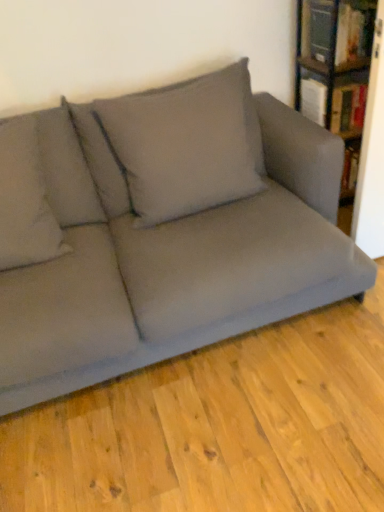
Measure the distance between wooden bookshelf at upper right and camera.

The distance of wooden bookshelf at upper right from camera is 6.03 feet.

Describe the element at coordinates (354, 31) in the screenshot. I see `hardcover book at upper right, which is the 2th book in bottom-to-top order` at that location.

Locate an element on the screen. The image size is (384, 512). gray fabric pillow at upper left, the 1th pillow positioned from the left is located at coordinates (66, 170).

This screenshot has height=512, width=384. Describe the element at coordinates (173, 233) in the screenshot. I see `matte gray couch at center` at that location.

Locate an element on the screen. Image resolution: width=384 pixels, height=512 pixels. hardcover book at upper right, placed as the second book when sorted from top to bottom is located at coordinates (335, 101).

Find the location of a particular element. This screenshot has width=384, height=512. wooden bookshelf at upper right is located at coordinates (336, 47).

Where is `the 2nd book behind the wooden bookshelf at upper right, counting from the anchor's position`? the 2nd book behind the wooden bookshelf at upper right, counting from the anchor's position is located at coordinates coord(335,101).

Could you tell me if wooden bookshelf at upper right is facing hardcover book at upper right, which is the first book from bottom to top?

Yes.

From their relative heights in the image, would you say wooden bookshelf at upper right is taller or shorter than hardcover book at upper right, which is the first book from bottom to top?

In the image, wooden bookshelf at upper right appears to be taller than hardcover book at upper right, which is the first book from bottom to top.

Considering the sizes of objects wooden bookshelf at upper right and hardcover book at upper right, which is the first book from bottom to top, in the image provided, who is smaller, wooden bookshelf at upper right or hardcover book at upper right, which is the first book from bottom to top,?

hardcover book at upper right, which is the first book from bottom to top, is smaller.

Is matte gray couch at center positioned beyond the bounds of hardcover book at upper right, placed as the second book when sorted from top to bottom?

Indeed, matte gray couch at center is completely outside hardcover book at upper right, placed as the second book when sorted from top to bottom.

From a real-world perspective, does matte gray couch at center stand above hardcover book at upper right, placed as the second book when sorted from top to bottom?

No.

From the image's perspective, which is above, matte gray couch at center or hardcover book at upper right, placed as the second book when sorted from top to bottom?

hardcover book at upper right, placed as the second book when sorted from top to bottom, appears higher in the image.

Is there a large distance between wooden bookshelf at upper right and gray fabric pillow at upper center, acting as the 1th pillow starting from the right?

No, wooden bookshelf at upper right is in close proximity to gray fabric pillow at upper center, acting as the 1th pillow starting from the right.

Is wooden bookshelf at upper right to the right of gray fabric pillow at upper center, acting as the 1th pillow starting from the right, from the viewer's perspective?

Correct, you'll find wooden bookshelf at upper right to the right of gray fabric pillow at upper center, acting as the 1th pillow starting from the right.

Is point (341, 131) farther from viewer compared to point (256, 157)?

That is True.

Is wooden bookshelf at upper right shorter than gray fabric pillow at upper center, acting as the 1th pillow starting from the right?

Incorrect, the height of wooden bookshelf at upper right does not fall short of that of gray fabric pillow at upper center, acting as the 1th pillow starting from the right.

Is wooden bookshelf at upper right wider than gray fabric pillow at upper left, which appears as the second pillow when viewed from the right?

Correct, the width of wooden bookshelf at upper right exceeds that of gray fabric pillow at upper left, which appears as the second pillow when viewed from the right.

From a real-world perspective, is wooden bookshelf at upper right on gray fabric pillow at upper left, the 1th pillow positioned from the left?

Correct, in the physical world, wooden bookshelf at upper right is higher than gray fabric pillow at upper left, the 1th pillow positioned from the left.

Is point (11, 399) positioned in front of point (50, 122)?

That is True.

Does matte gray couch at center come behind gray fabric pillow at upper left, the 1th pillow positioned from the left?

No, matte gray couch at center is in front of gray fabric pillow at upper left, the 1th pillow positioned from the left.

Is matte gray couch at center facing away from gray fabric pillow at upper left, which appears as the second pillow when viewed from the right?

That's right, matte gray couch at center is facing away from gray fabric pillow at upper left, which appears as the second pillow when viewed from the right.

In terms of height, does matte gray couch at center look taller or shorter compared to gray fabric pillow at upper left, which appears as the second pillow when viewed from the right?

Considering their sizes, matte gray couch at center has more height than gray fabric pillow at upper left, which appears as the second pillow when viewed from the right.

In order to click on the 2nd book positioned above the gray fabric pillow at upper center, the 2th pillow in the left-to-right sequence (from the image's perspective) in this screenshot , I will do `click(354, 31)`.

Is hardcover book at upper right, which is the 2th book in bottom-to-top order, beside gray fabric pillow at upper center, the 2th pillow in the left-to-right sequence?

They are not placed beside each other.

Could you tell me if hardcover book at upper right, which is the 2th book in bottom-to-top order, is facing gray fabric pillow at upper center, the 2th pillow in the left-to-right sequence?

No, hardcover book at upper right, which is the 2th book in bottom-to-top order, is not facing towards gray fabric pillow at upper center, the 2th pillow in the left-to-right sequence.

Considering the sizes of objects hardcover book at upper right, which is the 2th book in bottom-to-top order, and gray fabric pillow at upper center, acting as the 1th pillow starting from the right, in the image provided, who is wider, hardcover book at upper right, which is the 2th book in bottom-to-top order, or gray fabric pillow at upper center, acting as the 1th pillow starting from the right,?

With larger width is gray fabric pillow at upper center, acting as the 1th pillow starting from the right.

Considering the sizes of objects hardcover book at upper right, which is the first book from top to bottom, and matte gray couch at center in the image provided, who is taller, hardcover book at upper right, which is the first book from top to bottom, or matte gray couch at center?

matte gray couch at center is taller.

Between hardcover book at upper right, which is the 2th book in bottom-to-top order, and matte gray couch at center, which one has smaller width?

hardcover book at upper right, which is the 2th book in bottom-to-top order.

Which is nearer, (341, 9) or (174, 210)?

Point (341, 9) is positioned farther from the camera compared to point (174, 210).

Would you say hardcover book at upper right, which is the 2th book in bottom-to-top order, is outside matte gray couch at center?

hardcover book at upper right, which is the 2th book in bottom-to-top order, lies outside matte gray couch at center's area.

In the image, there is a wooden bookshelf at upper right. At what (x,y) coordinates should I click in order to perform the action: click on book below it (from the image's perspective). Please return your answer as a coordinate pair (x, y). Looking at the image, I should click on (335, 101).

You are a GUI agent. You are given a task and a screenshot of the screen. Output one action in this format:
    pyautogui.click(x=<x>, y=<y>)
    Task: Click on the 1st book above when counting from the matte gray couch at center (from the image's perspective)
    Image resolution: width=384 pixels, height=512 pixels.
    Given the screenshot: What is the action you would take?
    pyautogui.click(x=335, y=101)

Which object lies nearer to the anchor point gray fabric pillow at upper center, acting as the 1th pillow starting from the right, hardcover book at upper right, which is the first book from top to bottom, or wooden bookshelf at upper right?

The object closer to gray fabric pillow at upper center, acting as the 1th pillow starting from the right, is wooden bookshelf at upper right.

From the image, which object appears to be farther from wooden bookshelf at upper right, matte gray couch at center or hardcover book at upper right, placed as the second book when sorted from top to bottom?

Based on the image, matte gray couch at center appears to be further to wooden bookshelf at upper right.

From the picture: When comparing their distances from gray fabric pillow at upper center, the 2th pillow in the left-to-right sequence, does hardcover book at upper right, which is the first book from bottom to top, or gray fabric pillow at upper left, which appears as the second pillow when viewed from the right, seem closer?

gray fabric pillow at upper left, which appears as the second pillow when viewed from the right, lies closer to gray fabric pillow at upper center, the 2th pillow in the left-to-right sequence, than the other object.

When comparing their distances from gray fabric pillow at upper center, the 2th pillow in the left-to-right sequence, does matte gray couch at center or gray fabric pillow at upper left, the 1th pillow positioned from the left, seem closer?

matte gray couch at center is positioned closer to the anchor gray fabric pillow at upper center, the 2th pillow in the left-to-right sequence.

Estimate the real-world distances between objects in this image. Which object is closer to matte gray couch at center, gray fabric pillow at upper left, the 1th pillow positioned from the left, or hardcover book at upper right, which is the 2th book in bottom-to-top order?

Among the two, gray fabric pillow at upper left, the 1th pillow positioned from the left, is located nearer to matte gray couch at center.

Estimate the real-world distances between objects in this image. Which object is further from gray fabric pillow at upper left, which appears as the second pillow when viewed from the right, wooden bookshelf at upper right or hardcover book at upper right, placed as the second book when sorted from top to bottom?

The object further to gray fabric pillow at upper left, which appears as the second pillow when viewed from the right, is wooden bookshelf at upper right.

Considering their positions, is hardcover book at upper right, which is the 2th book in bottom-to-top order, positioned further to gray fabric pillow at upper center, the 2th pillow in the left-to-right sequence, than hardcover book at upper right, placed as the second book when sorted from top to bottom?

hardcover book at upper right, which is the 2th book in bottom-to-top order, is positioned further to the anchor gray fabric pillow at upper center, the 2th pillow in the left-to-right sequence.

Which object lies further to the anchor point hardcover book at upper right, which is the 2th book in bottom-to-top order, gray fabric pillow at upper left, the 1th pillow positioned from the left, or wooden bookshelf at upper right?

gray fabric pillow at upper left, the 1th pillow positioned from the left, lies further to hardcover book at upper right, which is the 2th book in bottom-to-top order, than the other object.

You are a GUI agent. You are given a task and a screenshot of the screen. Output one action in this format:
    pyautogui.click(x=<x>, y=<y>)
    Task: Click on the studio couch between gray fabric pillow at upper left, the 1th pillow positioned from the left, and hardcover book at upper right, placed as the second book when sorted from top to bottom, in the horizontal direction
    
    Given the screenshot: What is the action you would take?
    pyautogui.click(x=173, y=233)

Where is `pillow between gray fabric pillow at upper left, the 1th pillow positioned from the left, and hardcover book at upper right, which is the first book from bottom to top`? This screenshot has width=384, height=512. pillow between gray fabric pillow at upper left, the 1th pillow positioned from the left, and hardcover book at upper right, which is the first book from bottom to top is located at coordinates (186, 145).

In order to click on studio couch between gray fabric pillow at upper left, which appears as the second pillow when viewed from the right, and gray fabric pillow at upper center, acting as the 1th pillow starting from the right in this screenshot , I will do `click(173, 233)`.

The image size is (384, 512). I want to click on studio couch between gray fabric pillow at upper left, the 1th pillow positioned from the left, and wooden bookshelf at upper right, so click(x=173, y=233).